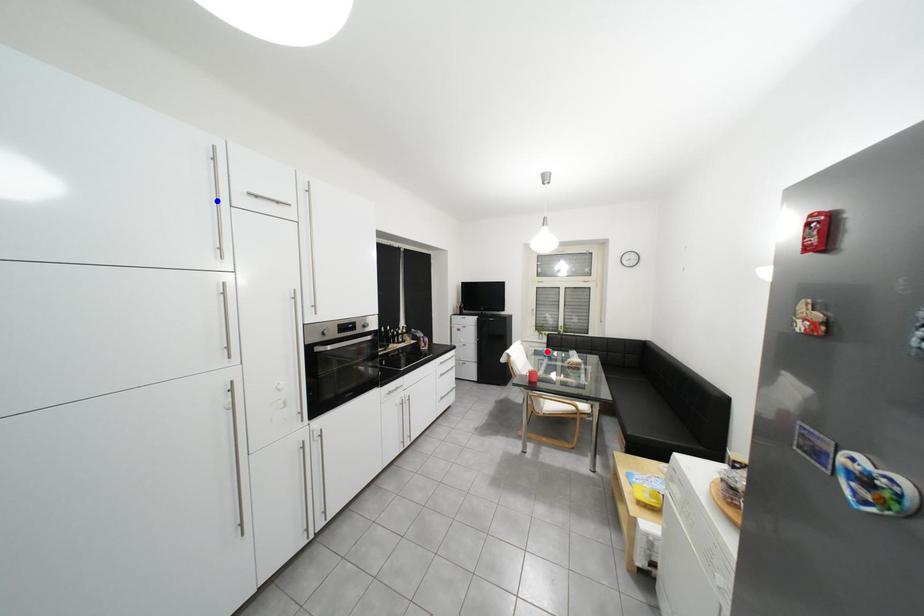
Question: Which of the two points in the image is closer to the camera?

Choices:
 (A) Blue point is closer.
 (B) Red point is closer.

Answer: (A)